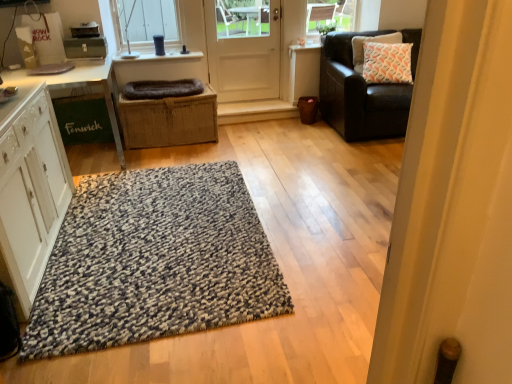
This screenshot has height=384, width=512. I want to click on empty space that is ontop of braided wicker basket at center (from a real-world perspective), so click(172, 93).